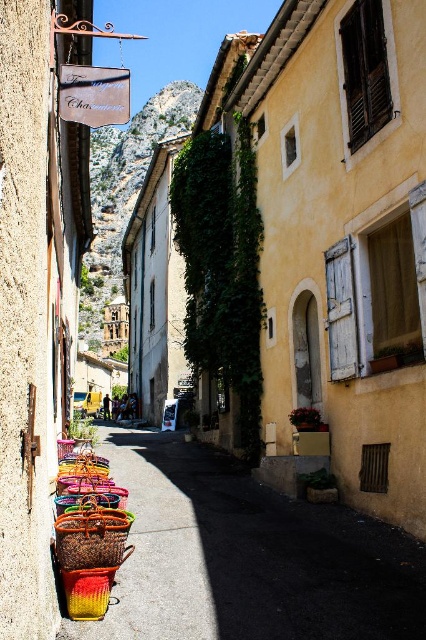
You are standing at the entrance of the village street and want to take a photo of the bright yellow woven basket at center. Considering your camera can focus up to 100 feet, will you be able to capture a clear image of it?

The bright yellow woven basket at center is 103.03 feet away from the camera, which exceeds the camera focus limit of 100 feet. Therefore, you won not be able to capture a clear image of it.

What is located at the point with coordinates (247, 556) in the scene?

The point at coordinates (247, 556) is occupied by smooth concrete pavement at center.

You are a tourist walking along the narrow street and want to place a small souvenir on the smooth concrete pavement at center. However, you notice the bright yellow woven basket at center is already there. Can you place your souvenir on the pavement without moving the basket?

The smooth concrete pavement at center is in front of the bright yellow woven basket at center, meaning the basket is behind the pavement from your perspective. You can place your souvenir on the pavement since it is in front and not obstructed by the basket.